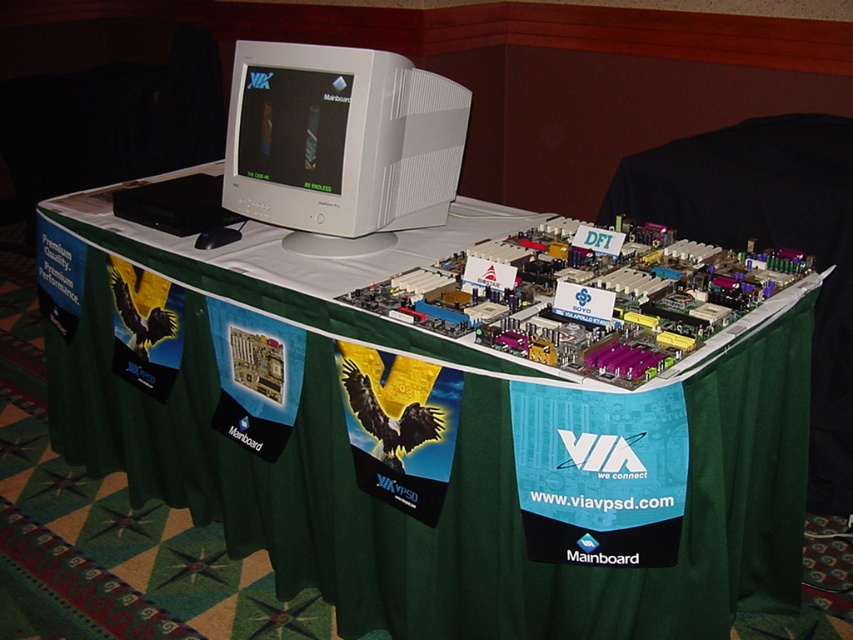
Looking at this image, between green fabric table at center and white plastic monitor at upper center, which one is positioned lower?

green fabric table at center is lower down.

Which is behind, point (354, 541) or point (294, 228)?

The point (294, 228) is behind.

This screenshot has height=640, width=853. What do you see at coordinates (425, 436) in the screenshot?
I see `green fabric table at center` at bounding box center [425, 436].

At what (x,y) coordinates should I click in order to perform the action: click on green fabric table at center. Please return your answer as a coordinate pair (x, y). This screenshot has height=640, width=853. Looking at the image, I should click on tap(425, 436).